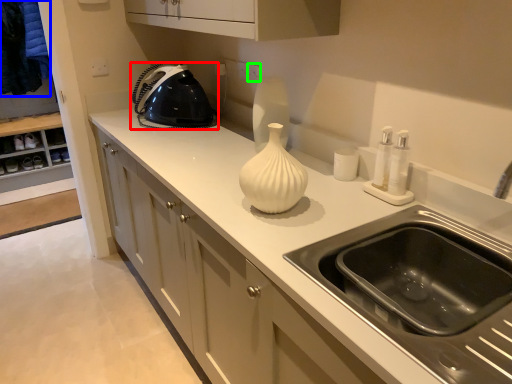
Question: Estimate the real-world distances between objects in this image. Which object is farther from home appliance (highlighted by a red box), laundry (highlighted by a blue box) or electric outlet (highlighted by a green box)?

Choices:
 (A) laundry
 (B) electric outlet

Answer: (A)